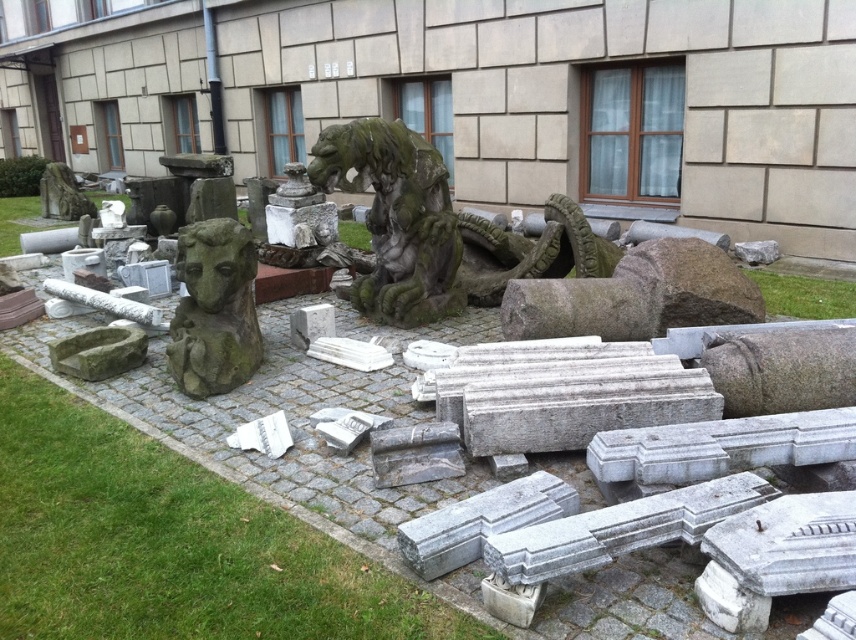
You are a gardener looking at the green grass at center and the green mossy stone at center in the outdoor area. Which object is positioned lower in the scene?

The green grass at center is positioned lower than the green mossy stone at center because it is located below it.